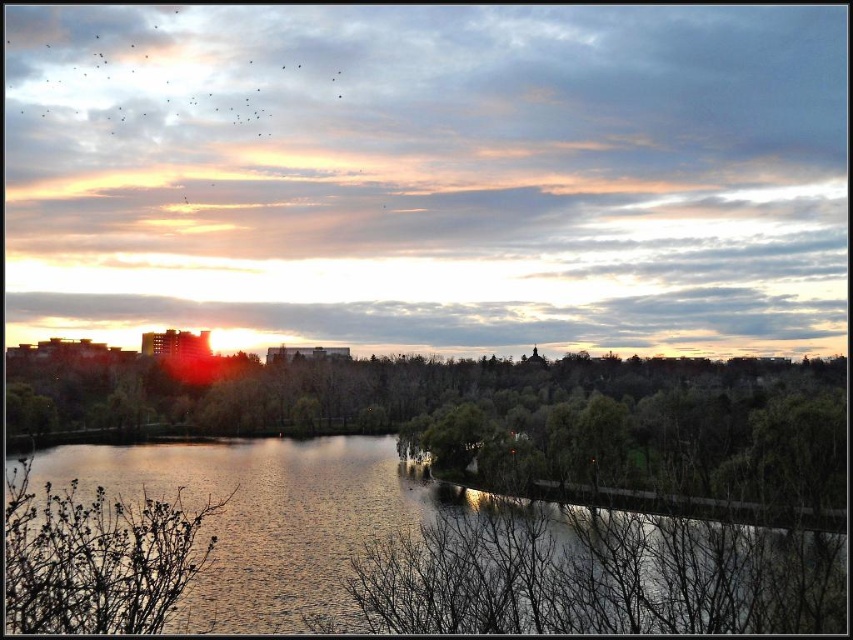
Question: Can you confirm if green leafy trees at center is positioned below glistening water at center?

Choices:
 (A) no
 (B) yes

Answer: (A)

Question: Which object appears farthest from the camera in this image?

Choices:
 (A) green leafy trees at center
 (B) glistening water at center

Answer: (A)

Question: Is green leafy trees at center positioned before glistening water at center?

Choices:
 (A) yes
 (B) no

Answer: (B)

Question: Can you confirm if green leafy trees at center is thinner than glistening water at center?

Choices:
 (A) yes
 (B) no

Answer: (B)